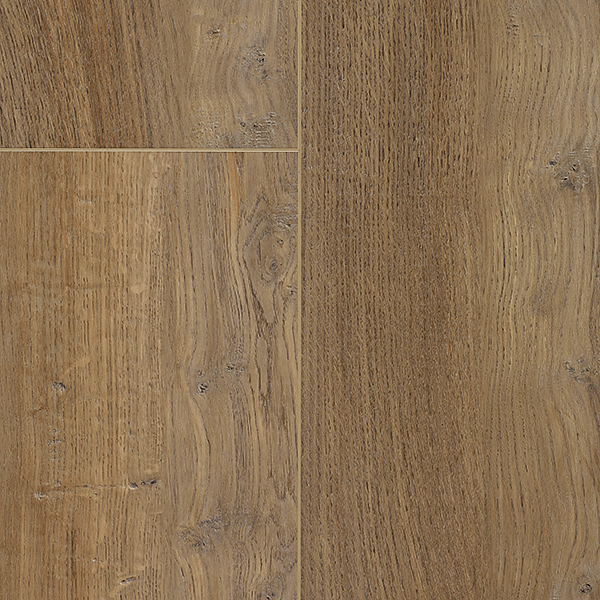
Image resolution: width=600 pixels, height=600 pixels. What are the coordinates of `hard wood flooring` in the screenshot? It's located at (522, 338), (137, 370), (105, 80).